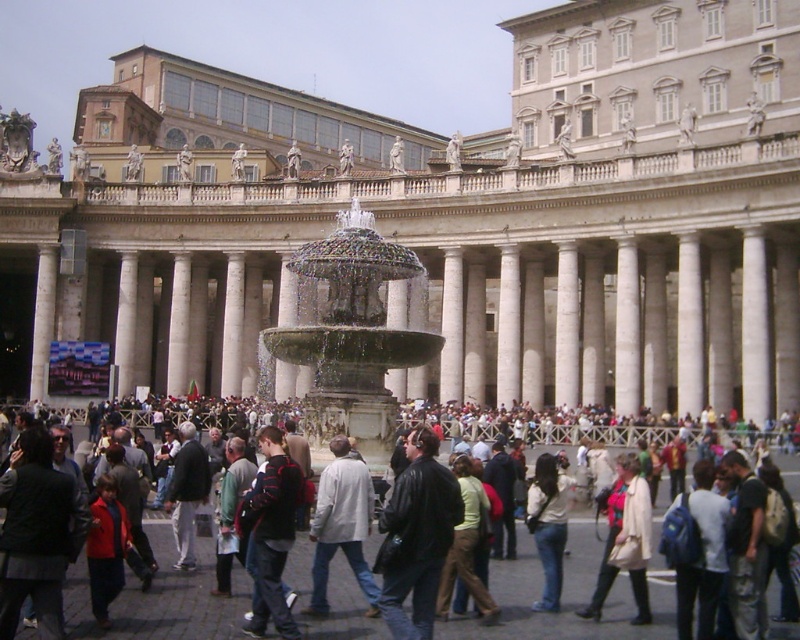
Is white marble palace at center shorter than dark gray jacket at center?

Incorrect, white marble palace at center's height does not fall short of dark gray jacket at center's.

Image resolution: width=800 pixels, height=640 pixels. What do you see at coordinates (444, 220) in the screenshot?
I see `white marble palace at center` at bounding box center [444, 220].

Between point (270, 145) and point (184, 550), which one is positioned behind?

The point (270, 145) is behind.

Where is `white marble palace at center`? The height and width of the screenshot is (640, 800). white marble palace at center is located at coordinates (444, 220).

Does light blue backpack at center have a greater height compared to dark gray jacket at center?

Correct, light blue backpack at center is much taller as dark gray jacket at center.

Is light blue backpack at center closer to camera compared to dark gray jacket at center?

That is True.

Measure the distance between point (688, 592) and camera.

114.32 feet

Locate an element on the screen. The height and width of the screenshot is (640, 800). light blue backpack at center is located at coordinates (701, 554).

Which of these two, dark gray clothing at center or beige leather jacket at center, stands shorter?

dark gray clothing at center

Is dark gray clothing at center further to the viewer compared to beige leather jacket at center?

No, it is not.

This screenshot has height=640, width=800. Find the location of `dark gray clothing at center`. dark gray clothing at center is located at coordinates (566, 595).

You are a GUI agent. You are given a task and a screenshot of the screen. Output one action in this format:
    pyautogui.click(x=<x>, y=<y>)
    Task: Click on the dark gray clothing at center
    This screenshot has width=800, height=640.
    Given the screenshot: What is the action you would take?
    point(566,595)